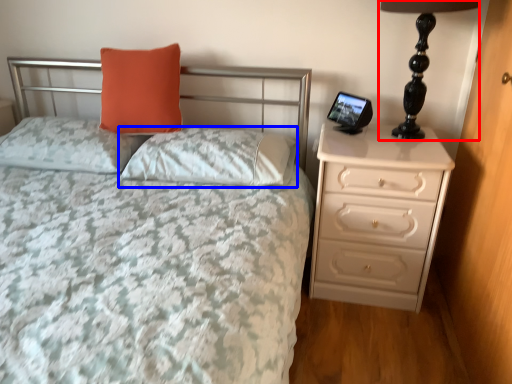
Question: Which of the following is the farthest to the observer, table lamp (highlighted by a red box) or pillow (highlighted by a blue box)?

Choices:
 (A) table lamp
 (B) pillow

Answer: (B)